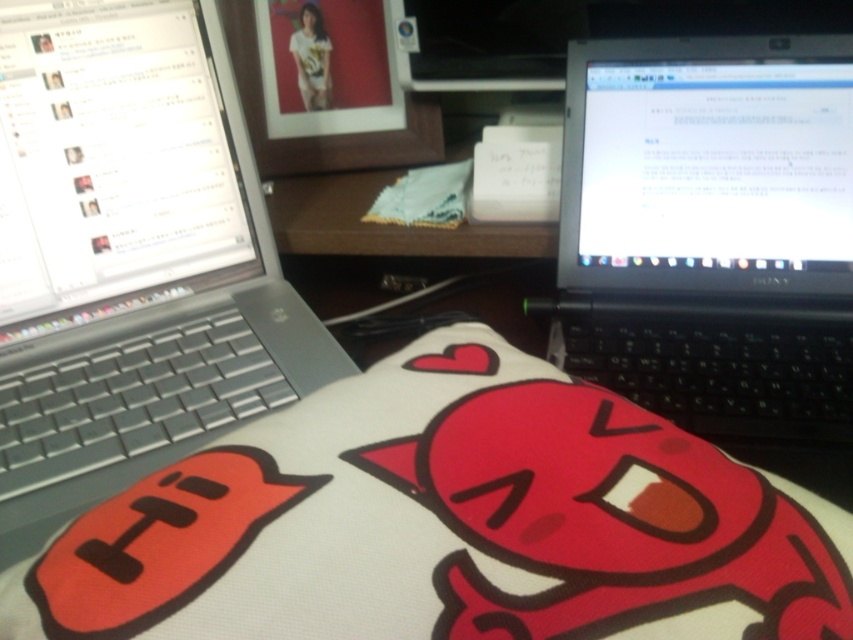
Between white fabric pillow with cartoon character at center and silver metallic laptop at left, which one has less height?

Standing shorter between the two is white fabric pillow with cartoon character at center.

Who is more distant from viewer, (x=538, y=516) or (x=171, y=72)?

Positioned behind is point (x=171, y=72).

The height and width of the screenshot is (640, 853). In order to click on white fabric pillow with cartoon character at center in this screenshot , I will do `click(447, 524)`.

Does point (509, 541) come in front of point (701, 422)?

Yes.

Between point (523, 448) and point (596, 77), which one is positioned in front?

Point (523, 448) is in front.

Is point (496, 433) positioned before point (816, 362)?

Yes, point (496, 433) is closer to viewer.

Where is `white fabric pillow with cartoon character at center`? Image resolution: width=853 pixels, height=640 pixels. white fabric pillow with cartoon character at center is located at coordinates (447, 524).

Does silver metallic laptop at left have a lesser width compared to black plastic laptop at right?

No, silver metallic laptop at left is not thinner than black plastic laptop at right.

Which of these two, silver metallic laptop at left or black plastic laptop at right, stands taller?

With more height is silver metallic laptop at left.

Who is more distant from viewer, (x=109, y=196) or (x=834, y=406)?

The point (x=109, y=196) is behind.

Where is `silver metallic laptop at left`? silver metallic laptop at left is located at coordinates (129, 257).